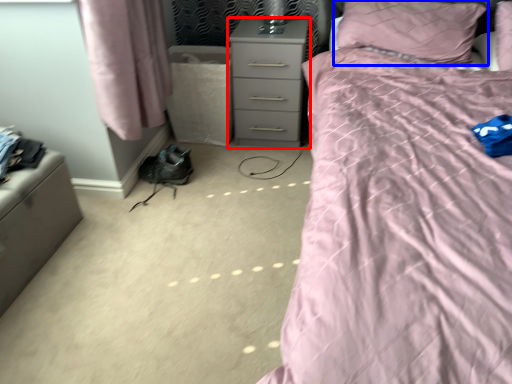
Question: Which of the following is the farthest to the observer, nightstand (highlighted by a red box) or pillow (highlighted by a blue box)?

Choices:
 (A) nightstand
 (B) pillow

Answer: (A)